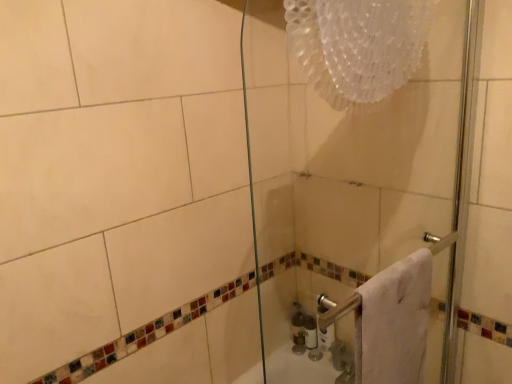
Question: Visually, is transparent glass shower door at center positioned to the left or to the right of white glossy bottle at lower center?

Choices:
 (A) right
 (B) left

Answer: (A)

Question: From the image's perspective, is transparent glass shower door at center located above or below white glossy bottle at lower center?

Choices:
 (A) below
 (B) above

Answer: (B)

Question: Which is nearer to the white glossy toilet paper at lower right?

Choices:
 (A) transparent glass shower door at center
 (B) white fluffy towel at right
 (C) white glossy bottle at lower center

Answer: (C)

Question: Which of these objects is positioned farthest from the white glossy toilet paper at lower right?

Choices:
 (A) white glossy bottle at lower center
 (B) transparent glass shower door at center
 (C) white fluffy towel at right

Answer: (C)